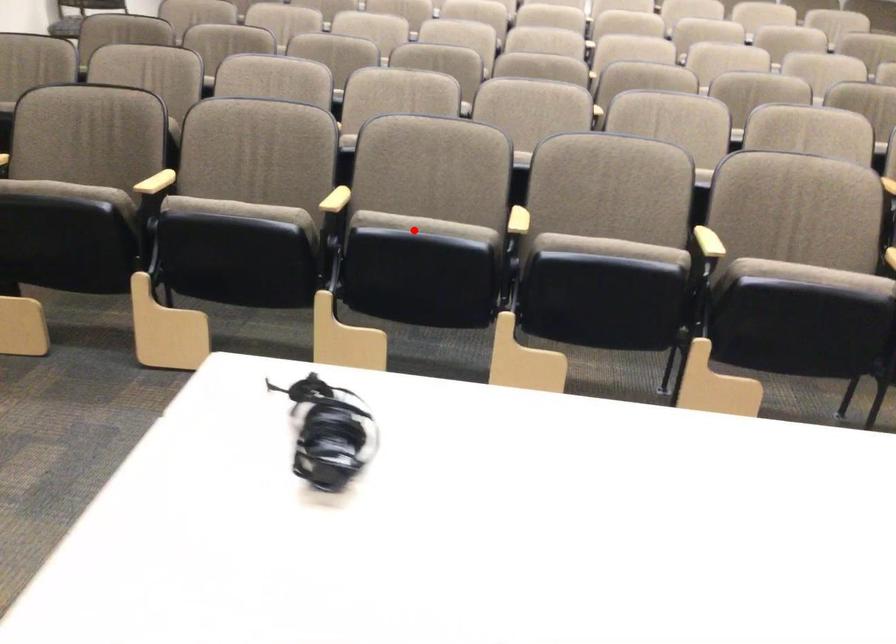
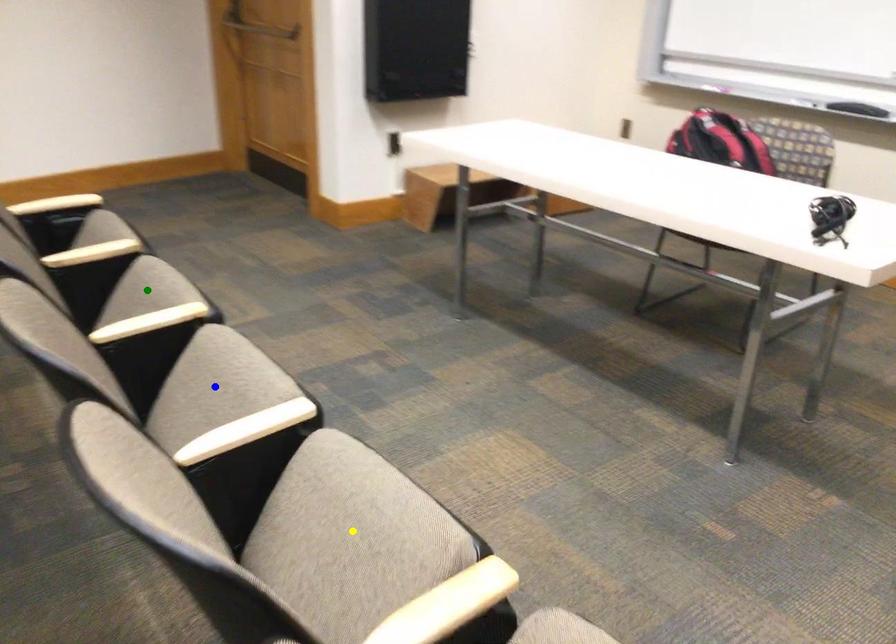
Question: I am providing you with two images of the same scene from different viewpoints. A red point is marked on the first image. You are given multiple points on the second image. In image 2, which mark is for the same physical point as the one in image 1?

Choices:
 (A) yellow point
 (B) blue point
 (C) green point

Answer: (A)